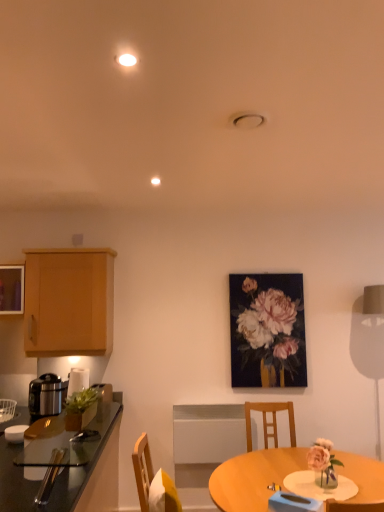
Where is `free space above metallic gold picture frame at center (from a real-world perspective)`? The height and width of the screenshot is (512, 384). free space above metallic gold picture frame at center (from a real-world perspective) is located at coordinates (278, 267).